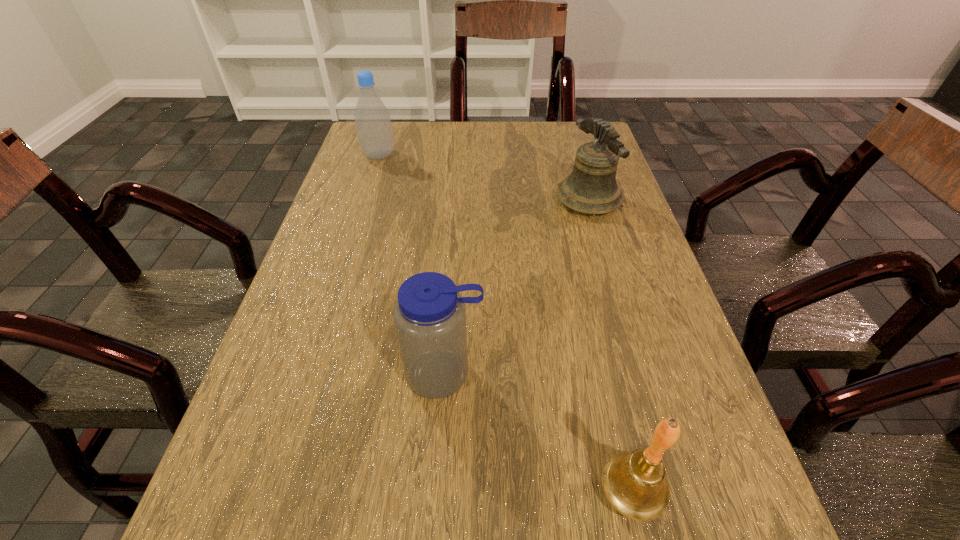
This screenshot has height=540, width=960. I want to click on the leftmost object, so click(372, 119).

The width and height of the screenshot is (960, 540). Find the location of `bottle`. bottle is located at coordinates (372, 119).

This screenshot has width=960, height=540. I want to click on the third farthest object, so tap(429, 315).

Locate an element on the screen. This screenshot has height=540, width=960. the third object from right to left is located at coordinates (429, 315).

Locate an element on the screen. the farther bell is located at coordinates (591, 188).

This screenshot has width=960, height=540. In order to click on the nearer bell in this screenshot , I will do `click(635, 484)`.

Locate an element on the screen. This screenshot has width=960, height=540. blank area located 0.180m on the front of the bottle is located at coordinates (364, 201).

Image resolution: width=960 pixels, height=540 pixels. In order to click on vacant space situated 0.090m with a carrying loop on the side of the second nearest object in this screenshot , I will do `click(439, 457)`.

Identify the location of free space located 0.310m on the front of the second farthest object. (625, 325).

Identify the location of vacant space located 0.120m on the right of the nearest object. This screenshot has height=540, width=960. (750, 491).